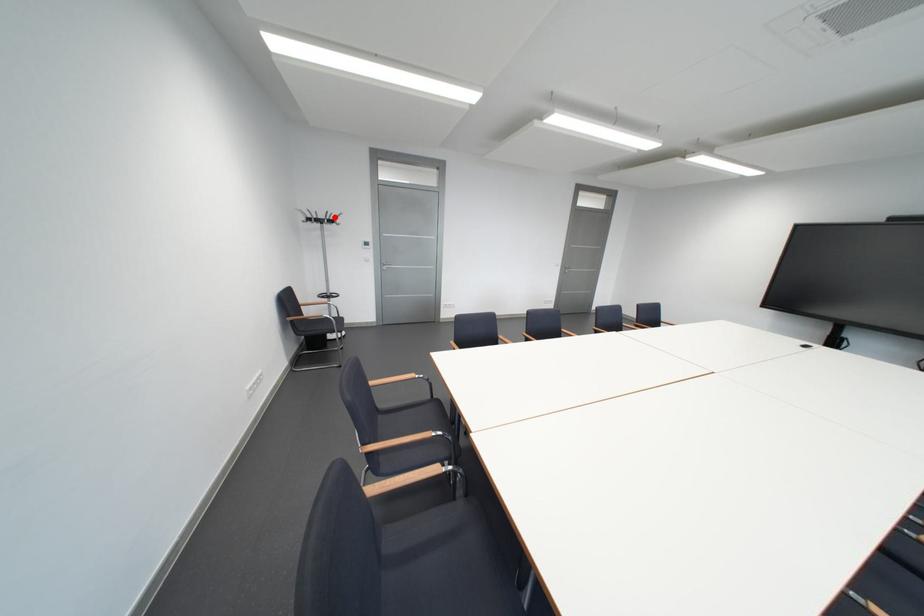
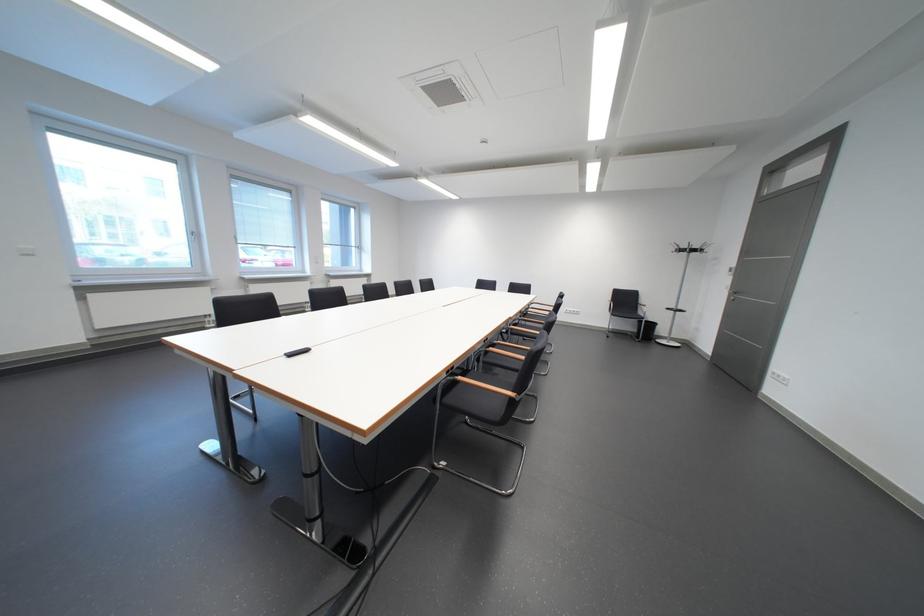
The point at the highlighted location is marked in the first image. Where is the corresponding point in the second image?

(698, 248)